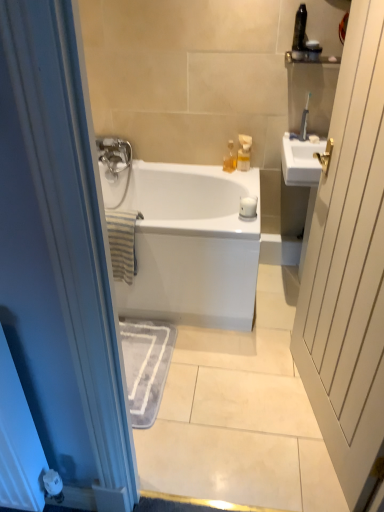
Identify the location of vacant space behind white wood door at right. [266, 342].